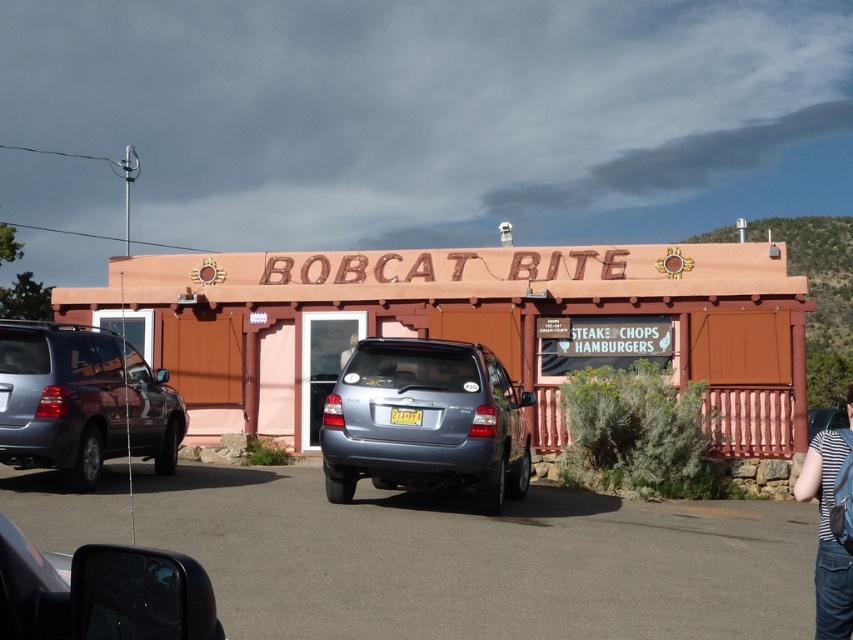
Between satin blue suv at center and shiny silver mirror at lower left, which one is positioned lower?

satin blue suv at center

Who is higher up, satin blue suv at center or shiny silver mirror at lower left?

Positioned higher is shiny silver mirror at lower left.

Consider the image. Who is more distant from viewer, (442, 353) or (126, 561)?

Point (442, 353)

Locate an element on the screen. The image size is (853, 640). satin blue suv at center is located at coordinates pyautogui.click(x=425, y=420).

Between gray asphalt parking lot at center and shiny silver mirror at lower left, which one is positioned lower?

gray asphalt parking lot at center is lower down.

Can you confirm if gray asphalt parking lot at center is positioned to the right of shiny silver mirror at lower left?

Indeed, gray asphalt parking lot at center is positioned on the right side of shiny silver mirror at lower left.

Is point (294, 600) more distant than point (38, 554)?

Yes, point (294, 600) is behind point (38, 554).

Locate an element on the screen. This screenshot has height=640, width=853. gray asphalt parking lot at center is located at coordinates (480, 560).

Which is in front, point (331, 428) or point (834, 424)?

Point (331, 428)

Which of these two, satin blue suv at center or metallic silver suv at center, stands shorter?

metallic silver suv at center is shorter.

At what (x,y) coordinates should I click in order to perform the action: click on satin blue suv at center. Please return your answer as a coordinate pair (x, y). Image resolution: width=853 pixels, height=640 pixels. Looking at the image, I should click on (425, 420).